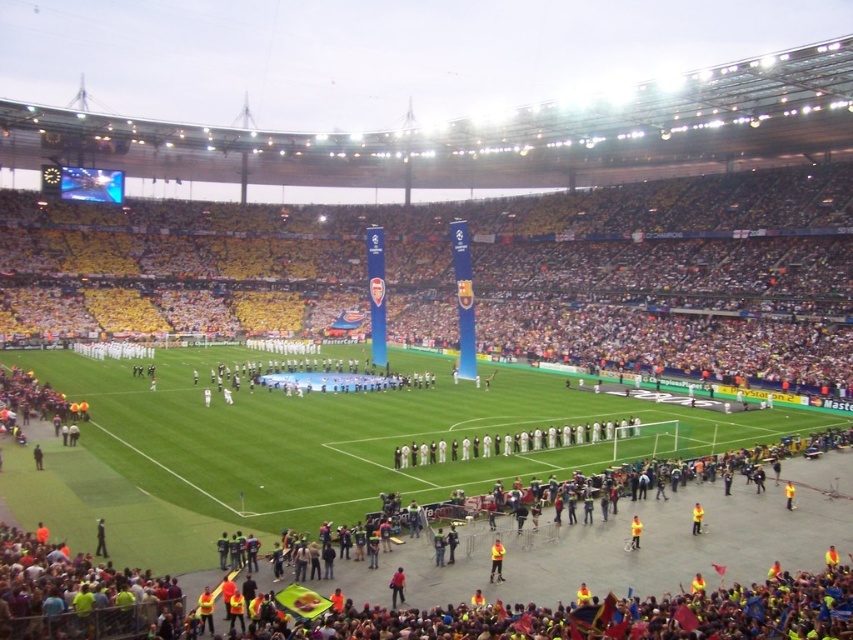
Looking at this image, you are a photographer positioned at the edge of the soccer field. You need to capture a photo of the yellow fabric at lower center. Based on the scene description, where should you aim your camera relative to the field?

The yellow fabric at lower center is located at point (496, 561), so you should aim your camera towards the lower center area of the field, specifically at the coordinates provided.

You are a photographer at the soccer stadium and want to capture the yellow fabric at lower center for a closeup shot. Where should you position your camera to get the best shot?

To capture the yellow fabric at lower center, position your camera near point (496, 561) for the best closeup shot.

You are a photographer at the soccer stadium and need to capture a photo that includes both the yellow fabric at lower center and the yellow reflective vest at center. Considering their sizes, which object will appear larger in the photo?

The yellow fabric at lower center will appear larger in the photo because it is much taller than the yellow reflective vest at center.